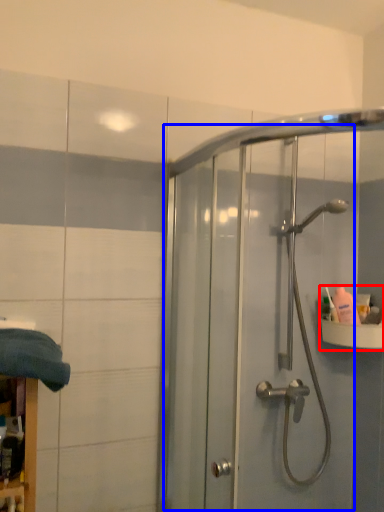
Question: Which object appears closest to the camera in this image, sink (highlighted by a red box) or screen door (highlighted by a blue box)?

Choices:
 (A) sink
 (B) screen door

Answer: (B)